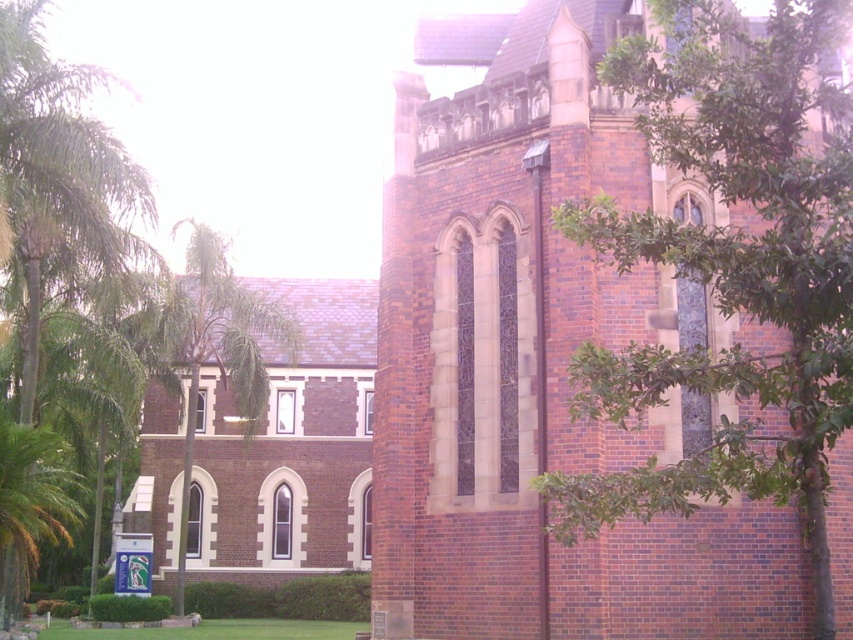
Locate an element on the screen. green leafy tree at right is located at coordinates (730, 266).

Does green leafy tree at right appear on the right side of green leafy palm at lower left?

Correct, you'll find green leafy tree at right to the right of green leafy palm at lower left.

Is point (775, 278) positioned after point (36, 524)?

No, (775, 278) is closer to viewer.

This screenshot has width=853, height=640. I want to click on green leafy tree at right, so click(x=730, y=266).

Can you confirm if green leafy tree at right is bigger than green leafy tree at left?

No.

Describe the element at coordinates (730, 266) in the screenshot. I see `green leafy tree at right` at that location.

Which is in front, point (822, 627) or point (67, 225)?

Positioned in front is point (822, 627).

I want to click on green leafy tree at right, so click(730, 266).

Does green leafy tree at left appear on the left side of green leafy palm at lower left?

Incorrect, green leafy tree at left is not on the left side of green leafy palm at lower left.

Who is higher up, green leafy tree at left or green leafy palm at lower left?

Positioned higher is green leafy tree at left.

The height and width of the screenshot is (640, 853). Identify the location of green leafy tree at left. (59, 173).